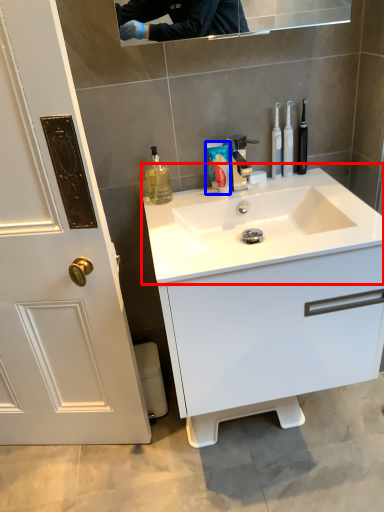
Question: Which point is further to the camera, sink (highlighted by a red box) or toothpaste (highlighted by a blue box)?

Choices:
 (A) sink
 (B) toothpaste

Answer: (B)